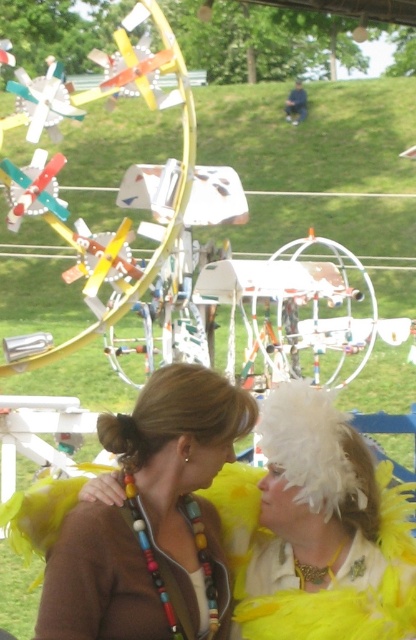
Question: Which of these objects is positioned farthest from the brown beaded necklace at center?

Choices:
 (A) brown hair bun at center
 (B) white feathered headdress at upper center

Answer: (B)

Question: Is brown beaded necklace at center below white feathered headdress at upper center?

Choices:
 (A) no
 (B) yes

Answer: (A)

Question: Which point is farther to the camera?

Choices:
 (A) brown hair bun at center
 (B) white feathered headdress at upper center

Answer: (A)

Question: Is brown beaded necklace at center below brown hair bun at center?

Choices:
 (A) no
 (B) yes

Answer: (B)

Question: Which object is farther from the camera taking this photo?

Choices:
 (A) brown beaded necklace at center
 (B) white feathered headdress at upper center

Answer: (B)

Question: Can you confirm if white feathered headdress at upper center is thinner than brown hair bun at center?

Choices:
 (A) yes
 (B) no

Answer: (B)